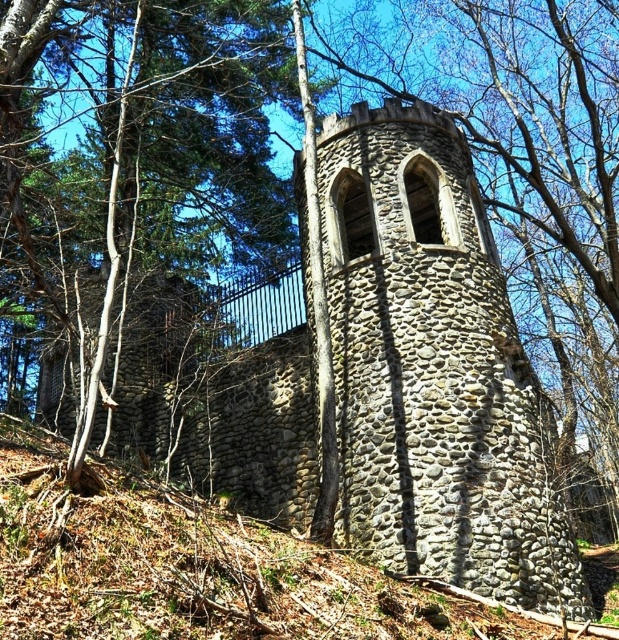
Is stone tower at center bigger than gray stone wall at center?

Yes.

Is point (258, 397) closer to camera compared to point (110, 552)?

No, it is behind (110, 552).

At what (x,y) coordinates should I click in order to perform the action: click on stone tower at center. Please return your answer as a coordinate pair (x, y). Image resolution: width=619 pixels, height=640 pixels. Looking at the image, I should click on (433, 369).